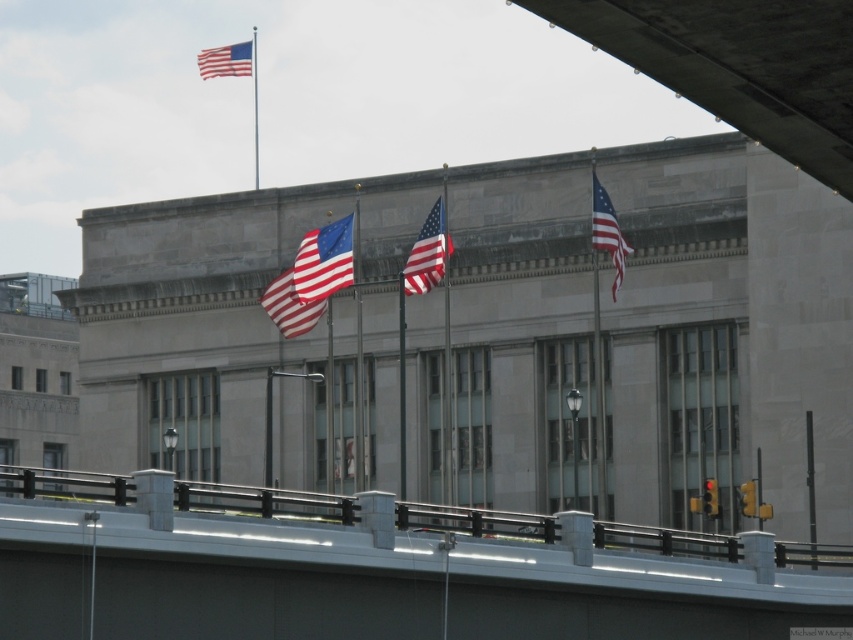
You are a visitor standing in front of the building and want to take a photo that includes both the matte fabric flag at upper right and the polished metal flag pole at upper center. Which object should you focus on first if you want to ensure both are in the frame?

The matte fabric flag at upper right has a smaller size compared to the polished metal flag pole at upper center, so you should focus on the larger polished metal flag pole at upper center first to ensure both fit within the frame.

In the scene shown: You are standing in front of the building and want to hang a new flag between the matte fabric flag at upper right and the polished metal flag pole at upper center. Is there space between them to place your new flag?

The matte fabric flag at upper right is to the right of the polished metal flag pole at upper center, so there is space between them to place the new flag.

You are standing in front of the large classical building and want to take a photo. You notice two points marked as point (146, 566) and point (355, 209). Which point will appear larger in your photo?

Point (146, 566) is closer to the camera than point (355, 209), so it will appear larger in the photo.